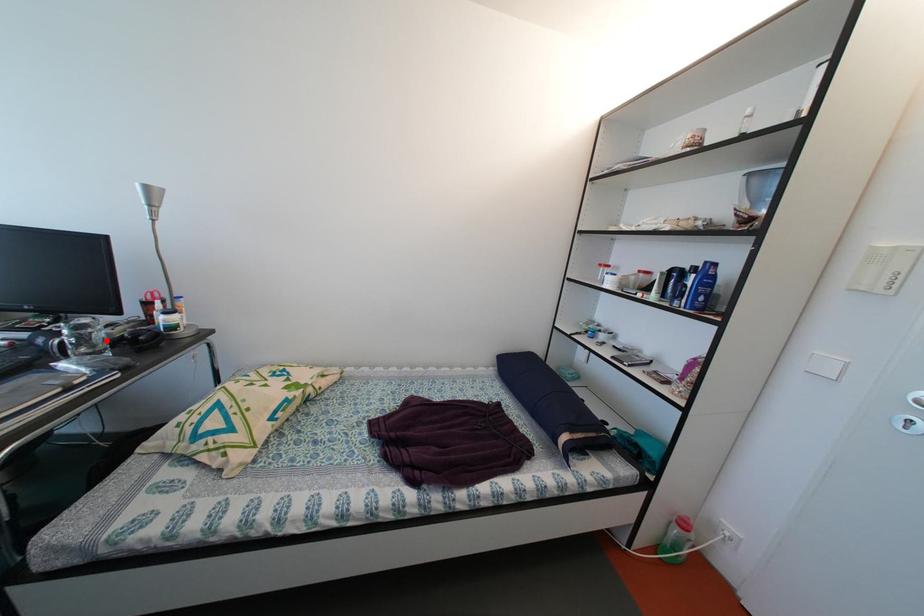
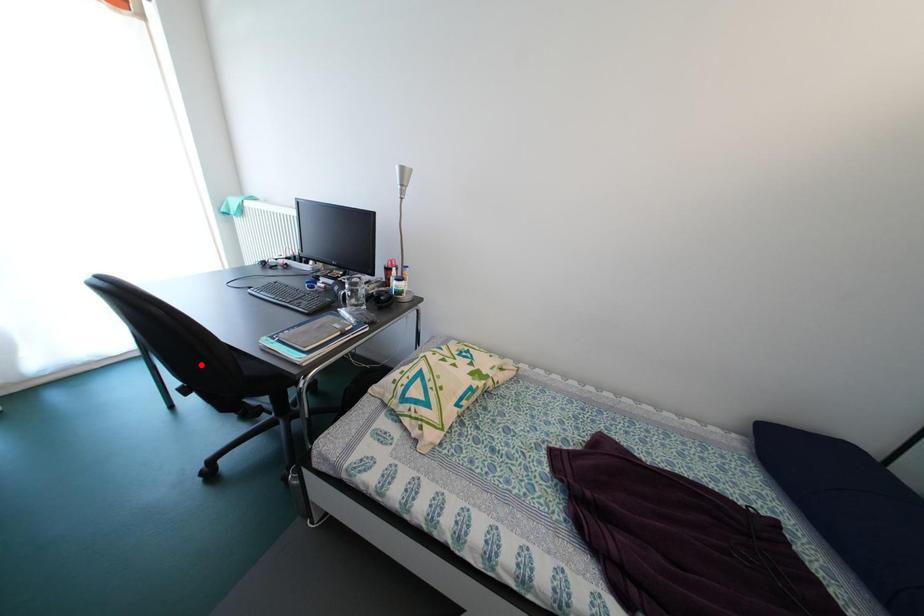
I am providing you with two images of the same scene from different viewpoints. A red point is marked on the first image and another point is marked on the second image. Does the point marked in image1 correspond to the same location as the one in image2?

No